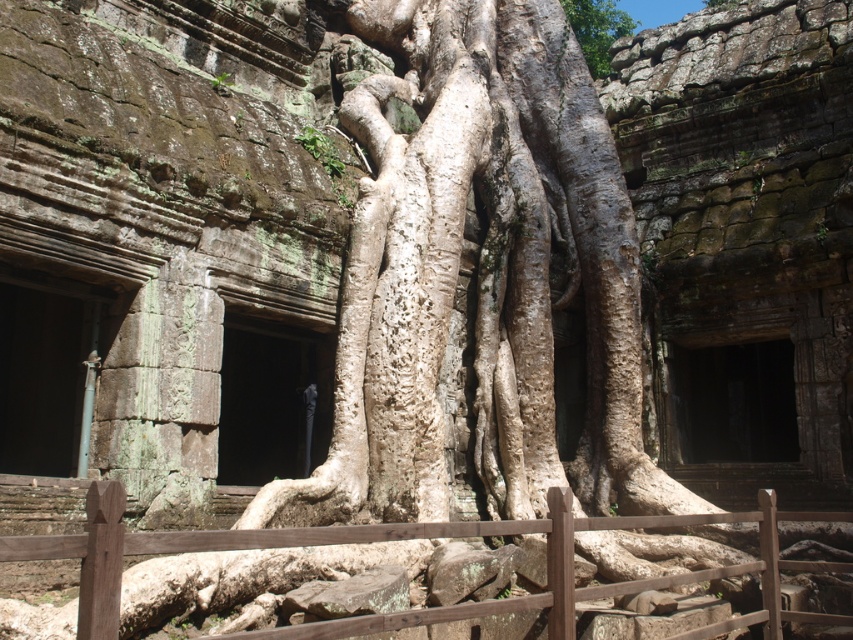
Question: Is brown wooden fence at center bigger than white bark tree at upper center?

Choices:
 (A) yes
 (B) no

Answer: (B)

Question: Which of the following is the farthest from the observer?

Choices:
 (A) white bark tree at upper center
 (B) brown wooden fence at center

Answer: (A)

Question: Can you confirm if brown wooden fence at center is wider than white bark tree at upper center?

Choices:
 (A) yes
 (B) no

Answer: (A)

Question: Does brown wooden fence at center have a larger size compared to white bark tree at upper center?

Choices:
 (A) yes
 (B) no

Answer: (B)